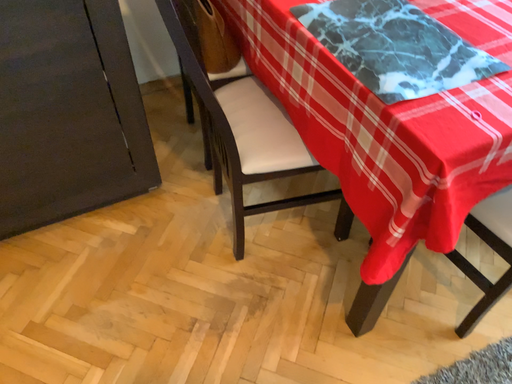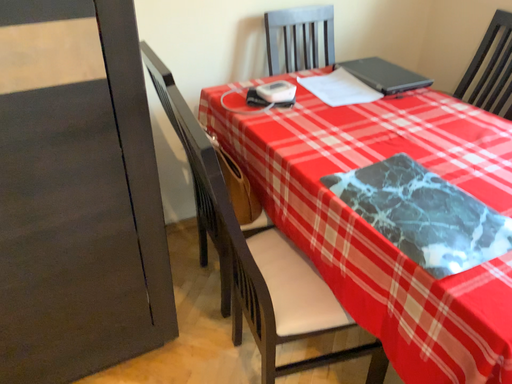
Question: How did the camera likely rotate when shooting the video?

Choices:
 (A) rotated downward
 (B) rotated upward

Answer: (B)